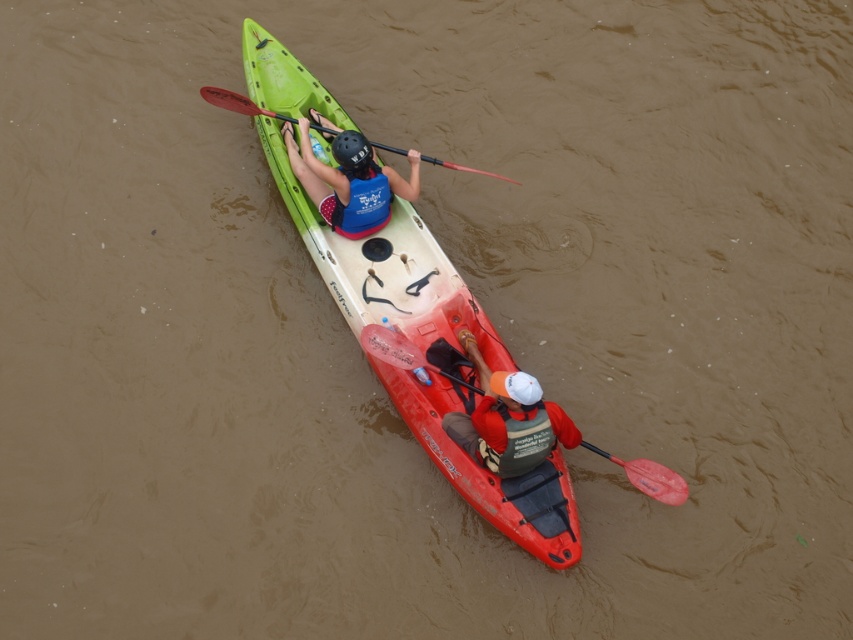
You are standing on the dock and want to take a photo of the orange fabric kayak at center with your camera. The camera has a maximum zoom range of 5 meters. Can you capture the kayak clearly without moving closer?

The orange fabric kayak at center and camera are 6.83 meters apart, which exceeds the camera maximum zoom range of 5 meters. Therefore, you cannot capture the kayak clearly without moving closer.

You are a safety inspector checking the kayakers. You see the matte blue life vest at center and the rubber paddle at lower right. Which object is wider?

The matte blue life vest at center is wider than the rubber paddle at lower right.